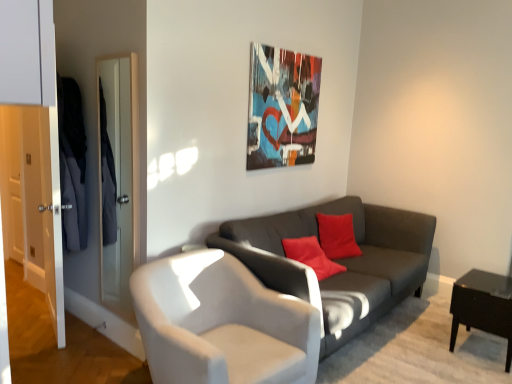
This screenshot has height=384, width=512. Describe the element at coordinates (221, 323) in the screenshot. I see `white leather chair at center` at that location.

Identify the location of metallic abstract art at upper center. The height and width of the screenshot is (384, 512). (282, 107).

What do you see at coordinates (483, 306) in the screenshot? I see `black glossy side table at lower right` at bounding box center [483, 306].

You are a GUI agent. You are given a task and a screenshot of the screen. Output one action in this format:
    pyautogui.click(x=<x>, y=<y>)
    Task: Click on the dark gray fabric couch at center
    The image size is (512, 384).
    Given the screenshot: What is the action you would take?
    pyautogui.click(x=338, y=261)

This screenshot has width=512, height=384. In order to click on white leather chair at center in this screenshot , I will do `click(221, 323)`.

Who is more distant, white leather chair at center or black glossy side table at lower right?

black glossy side table at lower right is behind.

From a real-world perspective, who is located higher, white leather chair at center or black glossy side table at lower right?

white leather chair at center is physically above.

The height and width of the screenshot is (384, 512). I want to click on table located on the right of white leather chair at center, so click(483, 306).

Is dark gray fabric couch at center in front of or behind metallic abstract art at upper center in the image?

In the image, dark gray fabric couch at center appears in front of metallic abstract art at upper center.

Is metallic abstract art at upper center located within dark gray fabric couch at center?

Definitely not — metallic abstract art at upper center is not inside dark gray fabric couch at center.

Is dark gray fabric couch at center facing towards metallic abstract art at upper center?

No, dark gray fabric couch at center is not facing towards metallic abstract art at upper center.

This screenshot has height=384, width=512. What are the coordinates of `picture frame above the black glossy side table at lower right (from the image's perspective)` in the screenshot? It's located at (282, 107).

Is black glossy side table at lower right to the left of metallic abstract art at upper center from the viewer's perspective?

In fact, black glossy side table at lower right is to the right of metallic abstract art at upper center.

Is black glossy side table at lower right positioned far away from metallic abstract art at upper center?

That's right, there is a large distance between black glossy side table at lower right and metallic abstract art at upper center.

Is black glossy side table at lower right looking in the opposite direction of metallic abstract art at upper center?

No.

How far apart are metallic abstract art at upper center and dark gray fabric couch at center?

The distance of metallic abstract art at upper center from dark gray fabric couch at center is 36.19 inches.

Considering the sizes of objects metallic abstract art at upper center and dark gray fabric couch at center in the image provided, who is bigger, metallic abstract art at upper center or dark gray fabric couch at center?

dark gray fabric couch at center.

Is dark gray fabric couch at center at the back of metallic abstract art at upper center?

No, metallic abstract art at upper center is not facing the opposite direction of dark gray fabric couch at center.

Considering the positions of point (280, 109) and point (404, 274), is point (280, 109) closer or farther from the camera than point (404, 274)?

Point (280, 109) is farther from the camera than point (404, 274).

Is point (172, 291) closer to viewer compared to point (330, 332)?

Yes, point (172, 291) is in front of point (330, 332).

Considering the relative sizes of white leather chair at center and dark gray fabric couch at center in the image provided, is white leather chair at center smaller than dark gray fabric couch at center?

Yes.

Which of these two, white leather chair at center or dark gray fabric couch at center, stands taller?

dark gray fabric couch at center.

Would you say white leather chair at center is inside or outside metallic abstract art at upper center?

white leather chair at center is not inside metallic abstract art at upper center, it's outside.

Who is taller, white leather chair at center or metallic abstract art at upper center?

metallic abstract art at upper center.

From a real-world perspective, is white leather chair at center below metallic abstract art at upper center?

Correct, in the physical world, white leather chair at center is lower than metallic abstract art at upper center.

From the picture: Does white leather chair at center have a greater width compared to metallic abstract art at upper center?

Correct, the width of white leather chair at center exceeds that of metallic abstract art at upper center.

Is metallic abstract art at upper center closer to camera compared to black glossy side table at lower right?

No, it is not.

Does point (288, 119) come in front of point (459, 304)?

No.

From a real-world perspective, is metallic abstract art at upper center above or below black glossy side table at lower right?

Clearly, from a real-world perspective, metallic abstract art at upper center is above black glossy side table at lower right.

Could you measure the distance between metallic abstract art at upper center and black glossy side table at lower right?

5.88 feet.

Where is `table behind the white leather chair at center`? table behind the white leather chair at center is located at coordinates (483, 306).

Locate an element on the screen. Image resolution: width=512 pixels, height=384 pixels. picture frame to the left of dark gray fabric couch at center is located at coordinates (282, 107).

Considering their positions, is dark gray fabric couch at center positioned further to black glossy side table at lower right than metallic abstract art at upper center?

metallic abstract art at upper center.

Consider the image. When comparing their distances from metallic abstract art at upper center, does black glossy side table at lower right or dark gray fabric couch at center seem closer?

Based on the image, dark gray fabric couch at center appears to be nearer to metallic abstract art at upper center.

Looking at the image, which one is located further to white leather chair at center, metallic abstract art at upper center or black glossy side table at lower right?

Based on the image, black glossy side table at lower right appears to be further to white leather chair at center.

Which object lies nearer to the anchor point black glossy side table at lower right, metallic abstract art at upper center or dark gray fabric couch at center?

Based on the image, dark gray fabric couch at center appears to be nearer to black glossy side table at lower right.

Looking at the image, which one is located closer to metallic abstract art at upper center, black glossy side table at lower right or white leather chair at center?

white leather chair at center is closer to metallic abstract art at upper center.

When comparing their distances from dark gray fabric couch at center, does black glossy side table at lower right or white leather chair at center seem closer?

white leather chair at center lies closer to dark gray fabric couch at center than the other object.

Which object lies nearer to the anchor point black glossy side table at lower right, dark gray fabric couch at center or white leather chair at center?

dark gray fabric couch at center lies closer to black glossy side table at lower right than the other object.

Estimate the real-world distances between objects in this image. Which object is closer to metallic abstract art at upper center, white leather chair at center or black glossy side table at lower right?

The object closer to metallic abstract art at upper center is white leather chair at center.

Locate an element on the screen. The width and height of the screenshot is (512, 384). studio couch between metallic abstract art at upper center and white leather chair at center from top to bottom is located at coordinates (338, 261).

This screenshot has height=384, width=512. What are the coordinates of `studio couch situated between white leather chair at center and black glossy side table at lower right from left to right` in the screenshot? It's located at (338, 261).

The height and width of the screenshot is (384, 512). Find the location of `picture frame situated between white leather chair at center and black glossy side table at lower right from left to right`. picture frame situated between white leather chair at center and black glossy side table at lower right from left to right is located at coordinates (282, 107).

This screenshot has width=512, height=384. I want to click on studio couch that lies between metallic abstract art at upper center and black glossy side table at lower right from top to bottom, so click(338, 261).